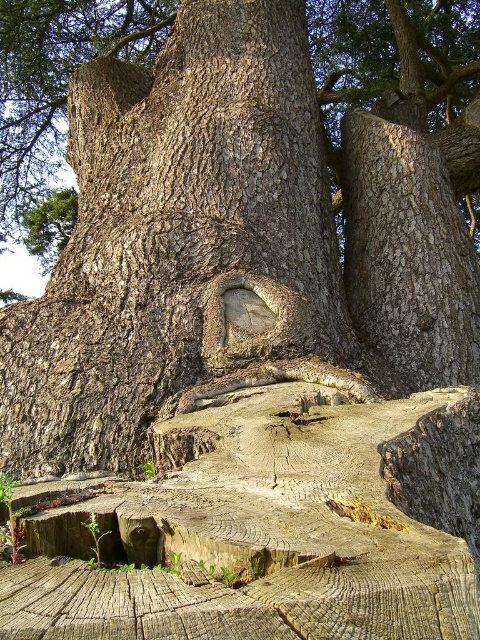
Which is more to the right, yellowish-brown wood at center or smooth brown bark at center?

From the viewer's perspective, smooth brown bark at center appears more on the right side.

This screenshot has width=480, height=640. Describe the element at coordinates (264, 525) in the screenshot. I see `yellowish-brown wood at center` at that location.

Does point (352, 481) come closer to viewer compared to point (440, 339)?

That is True.

This screenshot has width=480, height=640. I want to click on yellowish-brown wood at center, so click(x=264, y=525).